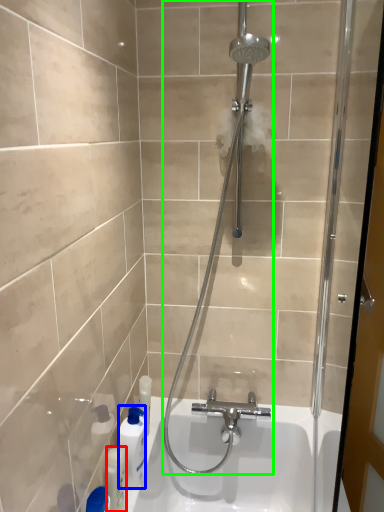
Question: Considering the real-world distances, which object is farthest from toiletry (highlighted by a red box)? cleaning product (highlighted by a blue box) or shower (highlighted by a green box)?

Choices:
 (A) cleaning product
 (B) shower

Answer: (B)